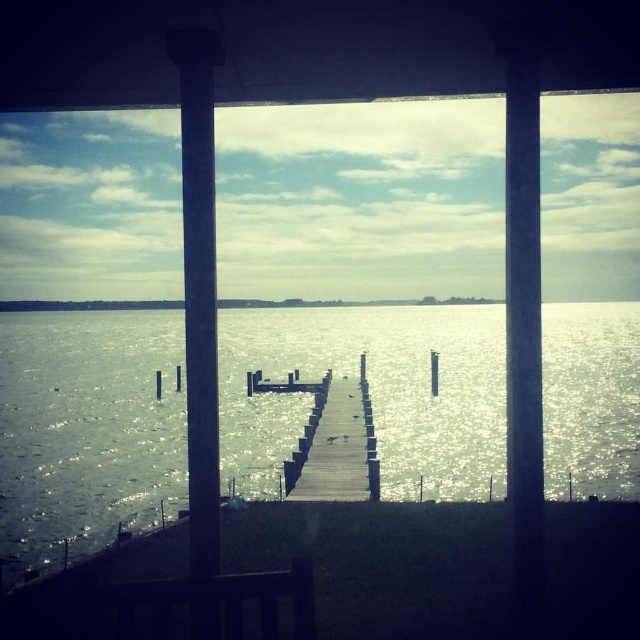
You are standing on the porch and want to take a photo of the glistening silver water at center without the smooth concrete pillar at center blocking the view. Is the pillar in front of or behind the water?

The smooth concrete pillar at center is behind the glistening silver water at center, so it will not block the view. You can take the photo without the pillar obstructing the water.

Consider the image. You are standing on the porch and want to take a photo of the glistening silver water at center. Where should you aim your camera to capture it?

You should aim your camera at point (371, 394) to capture the glistening silver water at center.

You are standing on the wooden dock at center and want to reach the glistening silver water at center. Which direction should you move to get closer to the water?

The glistening silver water at center is in front of the wooden dock at center, so you should move forward from the wooden dock at center to get closer to the glistening silver water at center.